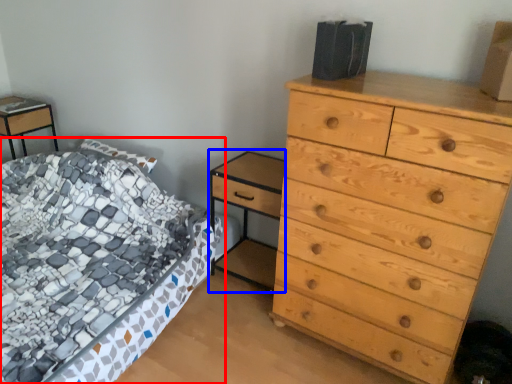
Question: Which point is further to the camera, bed (highlighted by a red box) or nightstand (highlighted by a blue box)?

Choices:
 (A) bed
 (B) nightstand

Answer: (B)